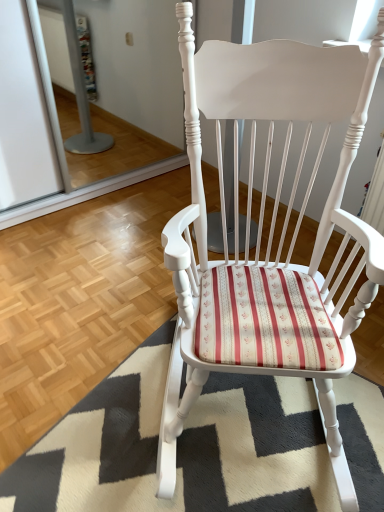
Question: Considering the positions of white textured rug at center and white painted wood rocking chair at center in the image, is white textured rug at center taller or shorter than white painted wood rocking chair at center?

Choices:
 (A) tall
 (B) short

Answer: (B)

Question: Would you say white textured rug at center is to the left or to the right of white painted wood rocking chair at center in the picture?

Choices:
 (A) left
 (B) right

Answer: (A)

Question: Looking at their shapes, would you say white textured rug at center is wider or thinner than white painted wood rocking chair at center?

Choices:
 (A) wide
 (B) thin

Answer: (A)

Question: Which is correct: white painted wood rocking chair at center is inside white textured rug at center, or outside of it?

Choices:
 (A) inside
 (B) outside

Answer: (B)

Question: Considering the positions of point (230, 76) and point (115, 455), is point (230, 76) closer or farther from the camera than point (115, 455)?

Choices:
 (A) farther
 (B) closer

Answer: (B)

Question: Is white painted wood rocking chair at center taller or shorter than white textured rug at center?

Choices:
 (A) tall
 (B) short

Answer: (A)

Question: Considering the positions of white painted wood rocking chair at center and white textured rug at center in the image, is white painted wood rocking chair at center wider or thinner than white textured rug at center?

Choices:
 (A) thin
 (B) wide

Answer: (A)